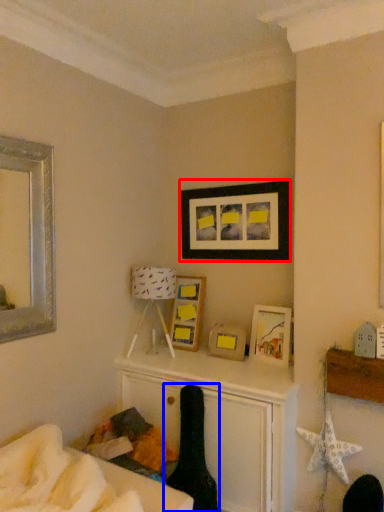
Question: Which object is closer to the camera taking this photo, picture frame (highlighted by a red box) or swivel chair (highlighted by a blue box)?

Choices:
 (A) picture frame
 (B) swivel chair

Answer: (B)